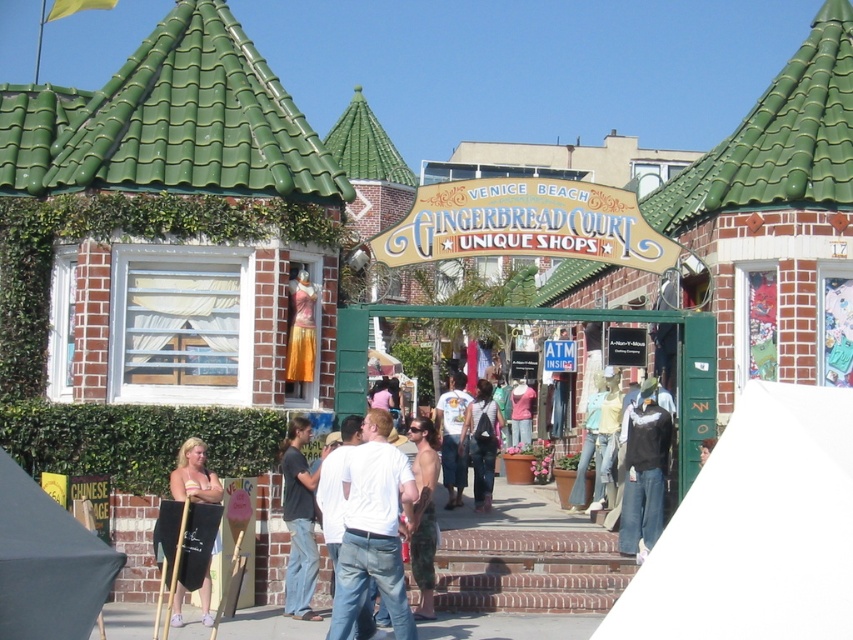
Question: Is wooden signboard at center in front of white t-shirt at center?

Choices:
 (A) yes
 (B) no

Answer: (A)

Question: Considering the relative positions of dark gray fabric canopy at lower left and denim pants at center in the image provided, where is dark gray fabric canopy at lower left located with respect to denim pants at center?

Choices:
 (A) right
 (B) left

Answer: (B)

Question: Does white cotton shirt at center have a smaller size compared to dark gray t-shirt at center?

Choices:
 (A) no
 (B) yes

Answer: (B)

Question: Which point appears closest to the camera in this image?

Choices:
 (A) (764, 413)
 (B) (68, 637)
 (C) (445, 442)

Answer: (B)

Question: Which point is closer to the camera?

Choices:
 (A) (756, 419)
 (B) (212, 476)
 (C) (373, 518)

Answer: (A)

Question: Among these points, which one is nearest to the camera?

Choices:
 (A) (456, 464)
 (B) (343, 596)
 (C) (473, 480)

Answer: (B)